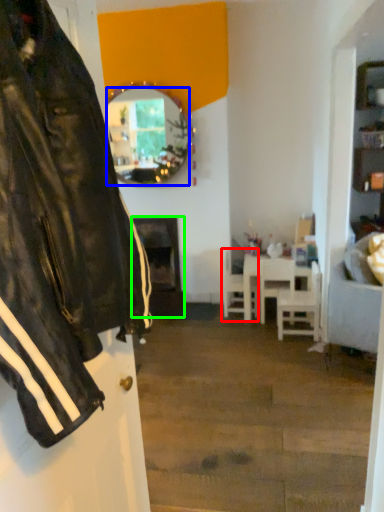
Question: Which object is the farthest from chair (highlighted by a red box)? Choose among these: mirror (highlighted by a blue box) or fireplace (highlighted by a green box).

Choices:
 (A) mirror
 (B) fireplace

Answer: (A)